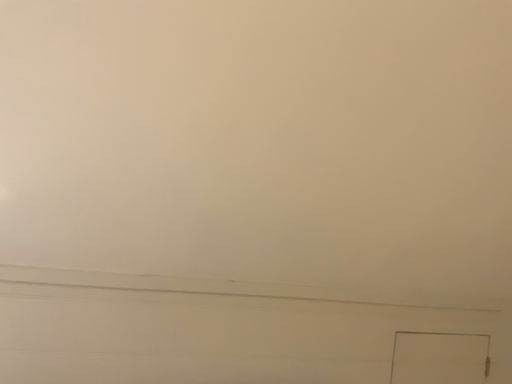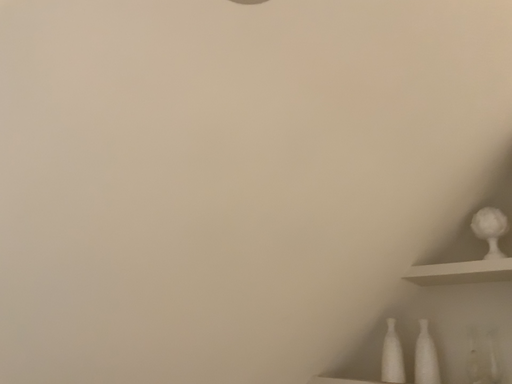
Question: How did the camera likely rotate when shooting the video?

Choices:
 (A) rotated left
 (B) rotated right

Answer: (B)